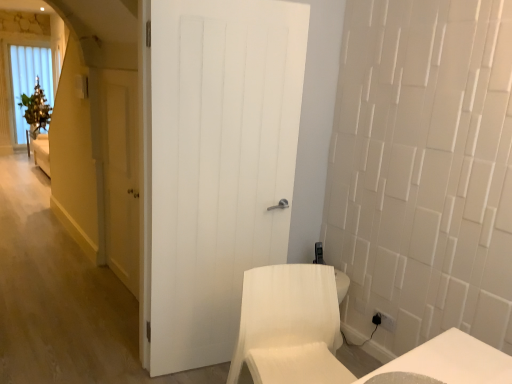
The image size is (512, 384). In order to click on white wooden door at center, marked as the first door in a front-to-back arrangement in this screenshot , I will do `click(218, 164)`.

Describe the element at coordinates (218, 164) in the screenshot. This screenshot has height=384, width=512. I see `white wooden door at center, the second door when ordered from back to front` at that location.

You are a GUI agent. You are given a task and a screenshot of the screen. Output one action in this format:
    pyautogui.click(x=<x>, y=<y>)
    Task: Click on the yellow matte door at left, the 2th door in the right-to-left sequence
    This screenshot has width=512, height=384.
    Given the screenshot: What is the action you would take?
    [121, 172]

What are the coordinates of `white wooden door at center, marked as the first door in a front-to-back arrangement` in the screenshot? It's located at (218, 164).

Is white wooden door at center, the second door when ordered from back to front, in front of white fabric chair at lower right?

No, the depth of white wooden door at center, the second door when ordered from back to front, is greater than that of white fabric chair at lower right.

Consider the image. How different are the orientations of white wooden door at center, the second door when ordered from back to front, and white fabric chair at lower right in degrees?

The angular difference between white wooden door at center, the second door when ordered from back to front, and white fabric chair at lower right is 1.38 degrees.

Is white wooden door at center, marked as the first door in a front-to-back arrangement, placed right next to white fabric chair at lower right?

No, white wooden door at center, marked as the first door in a front-to-back arrangement, is not beside white fabric chair at lower right.

Which of these two, white wooden door at center, the 2th door when ordered from left to right, or white fabric chair at lower right, is smaller?

With smaller size is white wooden door at center, the 2th door when ordered from left to right.

Between white fabric chair at lower right and yellow matte door at left, positioned as the 1th door in back-to-front order, which one has less height?

Standing shorter between the two is white fabric chair at lower right.

From the image's perspective, is white fabric chair at lower right above or below yellow matte door at left, the 2th door in the front-to-back sequence?

From the image's perspective, white fabric chair at lower right appears below yellow matte door at left, the 2th door in the front-to-back sequence.

Is white fabric chair at lower right turned away from yellow matte door at left, the 2th door in the front-to-back sequence?

Correct, white fabric chair at lower right is looking away from yellow matte door at left, the 2th door in the front-to-back sequence.

Considering the relative sizes of white wooden door at center, the second door when ordered from back to front, and yellow matte door at left, positioned as the 1th door in back-to-front order, in the image provided, is white wooden door at center, the second door when ordered from back to front, bigger than yellow matte door at left, positioned as the 1th door in back-to-front order,?

Yes.

Which is behind, white wooden door at center, the second door when ordered from back to front, or yellow matte door at left, the 2th door in the front-to-back sequence?

yellow matte door at left, the 2th door in the front-to-back sequence, is more distant.

Does white wooden door at center, marked as the first door in a front-to-back arrangement, have a greater height compared to yellow matte door at left, the 2th door in the front-to-back sequence?

Yes.

Find the location of a particular element. door below the white wooden door at center, the second door when ordered from back to front (from a real-world perspective) is located at coordinates (121, 172).

Is yellow matte door at left, the 2th door in the right-to-left sequence, smaller than white wooden door at center, the 2th door when ordered from left to right?

Indeed, yellow matte door at left, the 2th door in the right-to-left sequence, has a smaller size compared to white wooden door at center, the 2th door when ordered from left to right.

Between yellow matte door at left, the 2th door in the right-to-left sequence, and white wooden door at center, marked as the first door in a front-to-back arrangement, which one has less height?

Standing shorter between the two is yellow matte door at left, the 2th door in the right-to-left sequence.

Is white wooden door at center, marked as the first door in a front-to-back arrangement, completely or partially inside yellow matte door at left, positioned as the 1th door in back-to-front order?

No, white wooden door at center, marked as the first door in a front-to-back arrangement, is not a part of yellow matte door at left, positioned as the 1th door in back-to-front order.

In order to click on door below the yellow matte door at left, the 2th door in the right-to-left sequence (from the image's perspective) in this screenshot , I will do `click(218, 164)`.

Which is behind, white fabric chair at lower right or white wooden door at center, the 2th door when ordered from left to right?

white wooden door at center, the 2th door when ordered from left to right, is more distant.

Is white fabric chair at lower right oriented away from white wooden door at center, the 2th door when ordered from left to right?

Yes, white fabric chair at lower right's orientation is away from white wooden door at center, the 2th door when ordered from left to right.

From the image's perspective, is white fabric chair at lower right located above or below white wooden door at center, the 2th door when ordered from left to right?

white fabric chair at lower right is situated lower than white wooden door at center, the 2th door when ordered from left to right, in the image.

Is the depth of yellow matte door at left, positioned as the 1th door in back-to-front order, greater than that of white fabric chair at lower right?

Yes, the depth of yellow matte door at left, positioned as the 1th door in back-to-front order, is greater than that of white fabric chair at lower right.

From the image's perspective, who appears lower, yellow matte door at left, positioned as the 1th door in back-to-front order, or white fabric chair at lower right?

white fabric chair at lower right, from the image's perspective.

Considering the sizes of objects yellow matte door at left, the 2th door in the right-to-left sequence, and white fabric chair at lower right in the image provided, who is thinner, yellow matte door at left, the 2th door in the right-to-left sequence, or white fabric chair at lower right?

With smaller width is yellow matte door at left, the 2th door in the right-to-left sequence.

Is yellow matte door at left, positioned as the 1th door in back-to-front order, not within white fabric chair at lower right?

Yes, yellow matte door at left, positioned as the 1th door in back-to-front order, is not within white fabric chair at lower right.

The image size is (512, 384). In order to click on furniture on the right of white wooden door at center, the second door when ordered from back to front in this screenshot , I will do `click(289, 327)`.

Locate an element on the screen. furniture below the yellow matte door at left, positioned as the 1th door in back-to-front order (from a real-world perspective) is located at coordinates (289, 327).

From the image, which object appears to be nearer to yellow matte door at left, the 2th door in the front-to-back sequence, white fabric chair at lower right or white wooden door at center, the second door when ordered from back to front?

Based on the image, white wooden door at center, the second door when ordered from back to front, appears to be nearer to yellow matte door at left, the 2th door in the front-to-back sequence.

Based on their spatial positions, is white wooden door at center, which ranks as the 1th door in right-to-left order, or white fabric chair at lower right closer to yellow matte door at left, the 2th door in the right-to-left sequence?

white wooden door at center, which ranks as the 1th door in right-to-left order.

From the picture: Which object lies further to the anchor point white fabric chair at lower right, white wooden door at center, the 2th door when ordered from left to right, or yellow matte door at left, the 2th door in the right-to-left sequence?

Based on the image, yellow matte door at left, the 2th door in the right-to-left sequence, appears to be further to white fabric chair at lower right.

When comparing their distances from white wooden door at center, the second door when ordered from back to front, does yellow matte door at left, positioned as the 1th door in back-to-front order, or white fabric chair at lower right seem further?

Based on the image, yellow matte door at left, positioned as the 1th door in back-to-front order, appears to be further to white wooden door at center, the second door when ordered from back to front.

Estimate the real-world distances between objects in this image. Which object is closer to white fabric chair at lower right, yellow matte door at left, the 2th door in the front-to-back sequence, or white wooden door at center, marked as the first door in a front-to-back arrangement?

The object closer to white fabric chair at lower right is white wooden door at center, marked as the first door in a front-to-back arrangement.

Based on their spatial positions, is white fabric chair at lower right or yellow matte door at left, positioned as the 1th door in back-to-front order, further from white wooden door at center, the second door when ordered from back to front?

yellow matte door at left, positioned as the 1th door in back-to-front order, is further to white wooden door at center, the second door when ordered from back to front.

Image resolution: width=512 pixels, height=384 pixels. I want to click on door between white fabric chair at lower right and yellow matte door at left, positioned as the 1th door in back-to-front order, along the z-axis, so [218, 164].